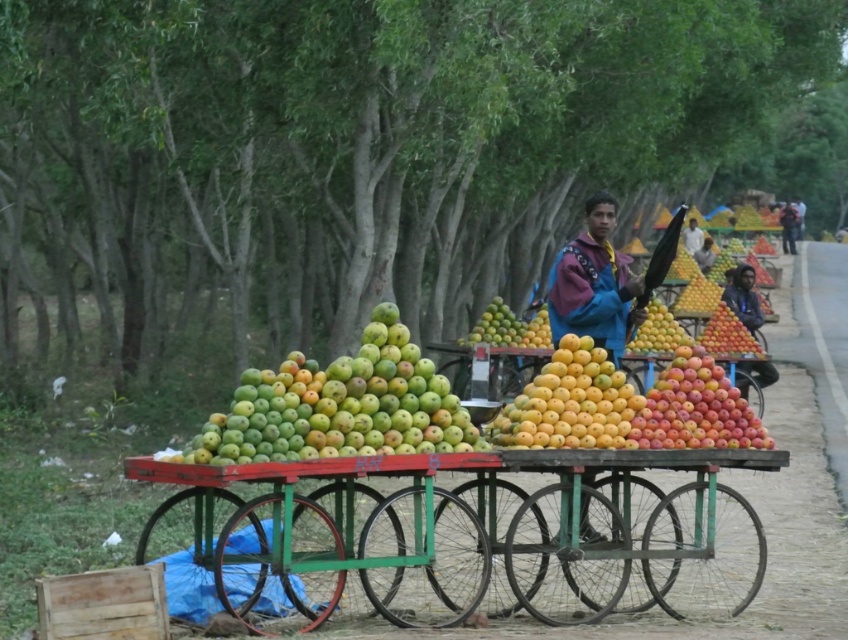
Does shiny red apples at center appear on the right side of wooden crate at lower left?

Yes, shiny red apples at center is to the right of wooden crate at lower left.

Is point (734, 444) positioned in front of point (77, 627)?

No, (734, 444) is further to viewer.

Where is `shiny red apples at center`? shiny red apples at center is located at coordinates [x=696, y=408].

Between yellow matte mangoes at center and blue fleece jacket at center, which one appears on the right side from the viewer's perspective?

blue fleece jacket at center

Between point (590, 376) and point (616, 356), which one is positioned in front?

Positioned in front is point (590, 376).

Does point (577, 387) lie in front of point (589, 284)?

Yes, it is.

This screenshot has height=640, width=848. What are the coordinates of `yellow matte mangoes at center` in the screenshot? It's located at (570, 403).

Is shiny orange mangoes at right taller than smooth yellow mango at center?

Correct, shiny orange mangoes at right is much taller as smooth yellow mango at center.

Between point (734, 353) and point (664, 314), which one is positioned in front?

Positioned in front is point (734, 353).

Identify the location of shiny orange mangoes at right. Image resolution: width=848 pixels, height=640 pixels. (728, 337).